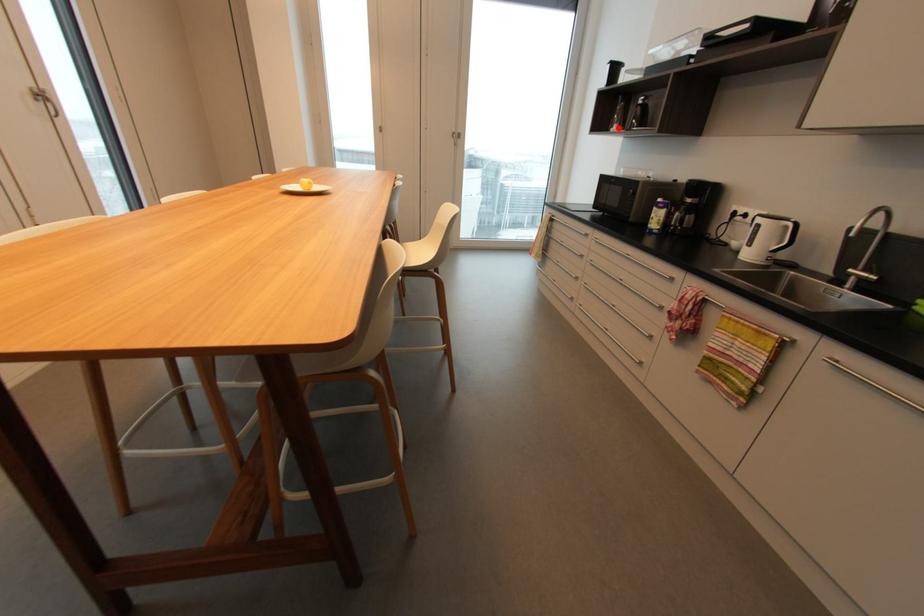
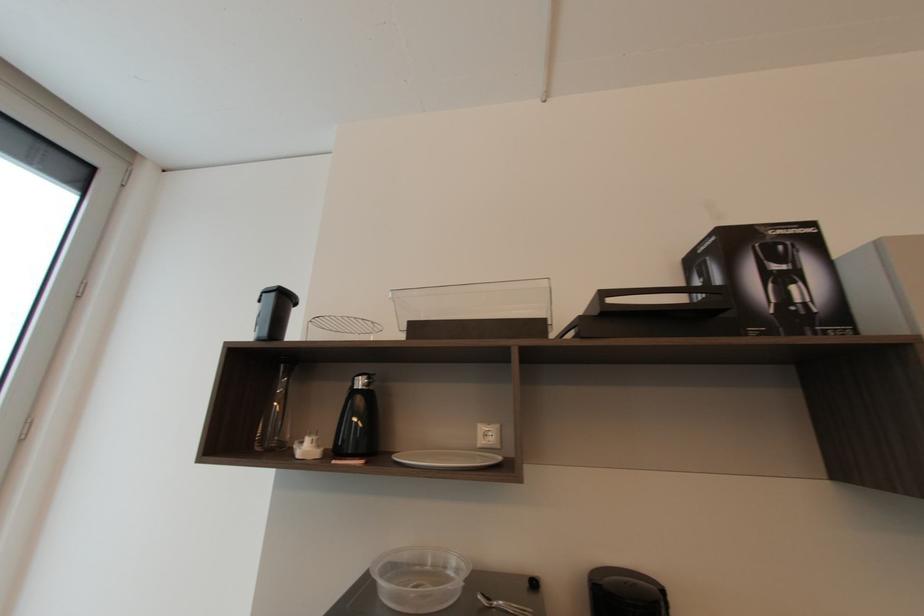
The point at the highlighted location is marked in the first image. Where is the corresponding point in the second image?

(310, 447)